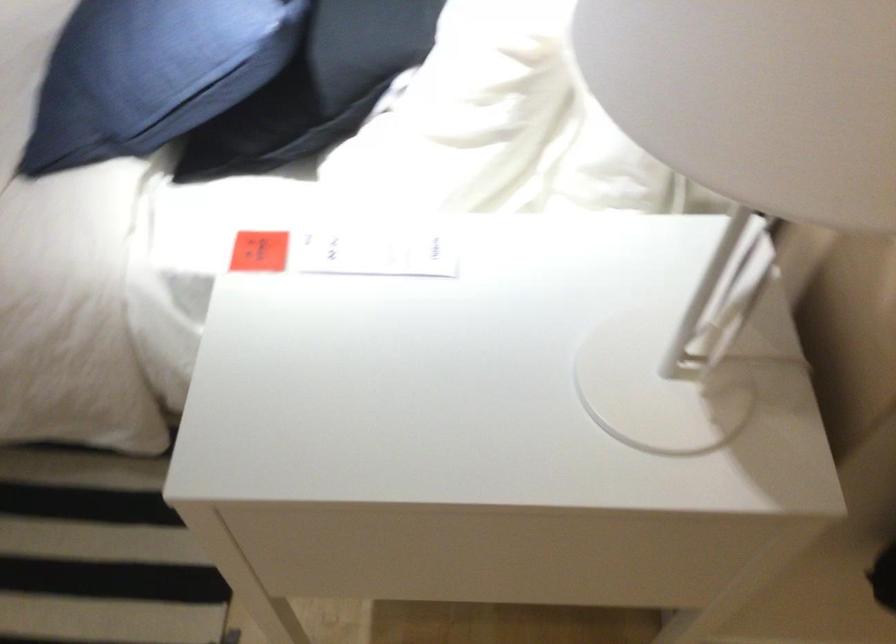
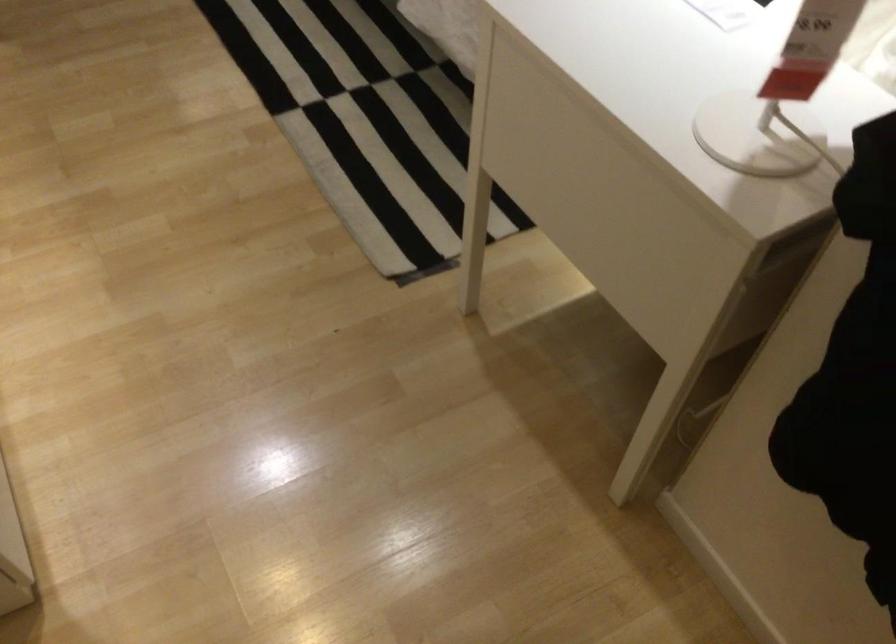
Question: The camera is either moving clockwise (left) or counter-clockwise (right) around the object. The first image is from the beginning of the video and the second image is from the end. Is the camera moving left or right when shooting the video?

Choices:
 (A) Left
 (B) Right

Answer: (B)